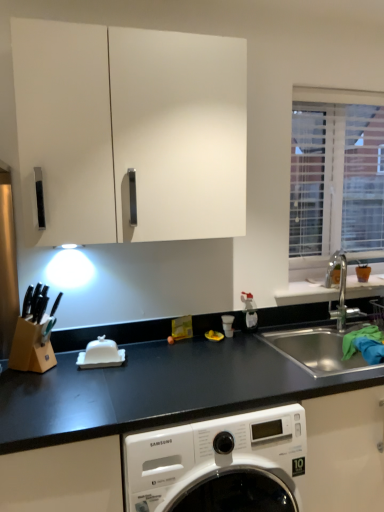
Question: From the image's perspective, is white glossy butter dish at center under white matte window sill at right?

Choices:
 (A) yes
 (B) no

Answer: (A)

Question: Could you tell me if white glossy butter dish at center is facing white matte window sill at right?

Choices:
 (A) no
 (B) yes

Answer: (A)

Question: Does white glossy butter dish at center have a larger size compared to white matte window sill at right?

Choices:
 (A) no
 (B) yes

Answer: (A)

Question: Is white glossy butter dish at center directly adjacent to white matte window sill at right?

Choices:
 (A) no
 (B) yes

Answer: (A)

Question: Is white glossy butter dish at center not near white matte window sill at right?

Choices:
 (A) yes
 (B) no

Answer: (A)

Question: Considering the relative positions of white glossy butter dish at center and white matte window sill at right in the image provided, is white glossy butter dish at center to the right of white matte window sill at right from the viewer's perspective?

Choices:
 (A) yes
 (B) no

Answer: (B)

Question: Is white matte window sill at right facing towards white glossy butter dish at center?

Choices:
 (A) no
 (B) yes

Answer: (A)

Question: Is white matte window sill at right closer to the viewer compared to white glossy butter dish at center?

Choices:
 (A) no
 (B) yes

Answer: (A)

Question: Does white matte window sill at right appear on the right side of white glossy butter dish at center?

Choices:
 (A) no
 (B) yes

Answer: (B)

Question: Considering the relative sizes of white matte window sill at right and white glossy butter dish at center in the image provided, is white matte window sill at right smaller than white glossy butter dish at center?

Choices:
 (A) no
 (B) yes

Answer: (A)

Question: Can you confirm if white matte window sill at right is thinner than white glossy butter dish at center?

Choices:
 (A) no
 (B) yes

Answer: (A)

Question: Can you confirm if white matte window sill at right is taller than white glossy butter dish at center?

Choices:
 (A) yes
 (B) no

Answer: (B)

Question: Is white matte window sill at right next to stainless steel sink at right?

Choices:
 (A) yes
 (B) no

Answer: (A)